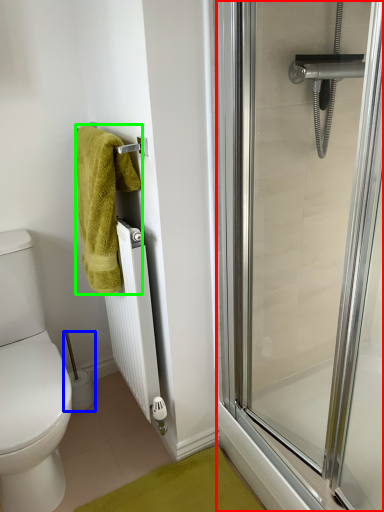
Question: Which is farther away from screen door (highlighted by a red box)? toilet paper (highlighted by a blue box) or towel (highlighted by a green box)?

Choices:
 (A) toilet paper
 (B) towel

Answer: (A)